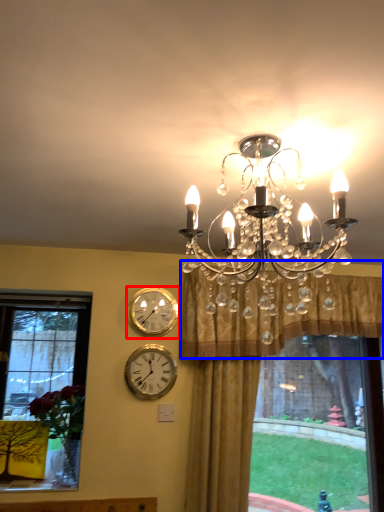
Question: Which object is further to the camera taking this photo, wall clock (highlighted by a red box) or curtain (highlighted by a blue box)?

Choices:
 (A) wall clock
 (B) curtain

Answer: (A)